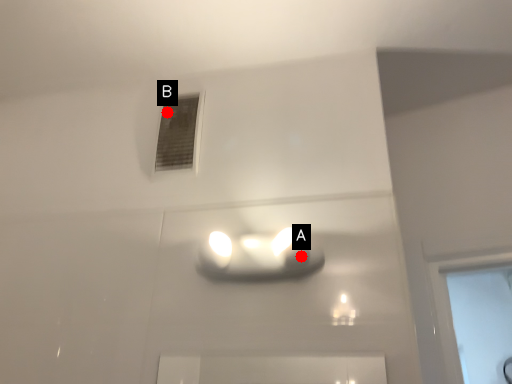
Question: Two points are circled on the image, labeled by A and B beside each circle. Which point appears closest to the camera in this image?

Choices:
 (A) A is closer
 (B) B is closer

Answer: (A)